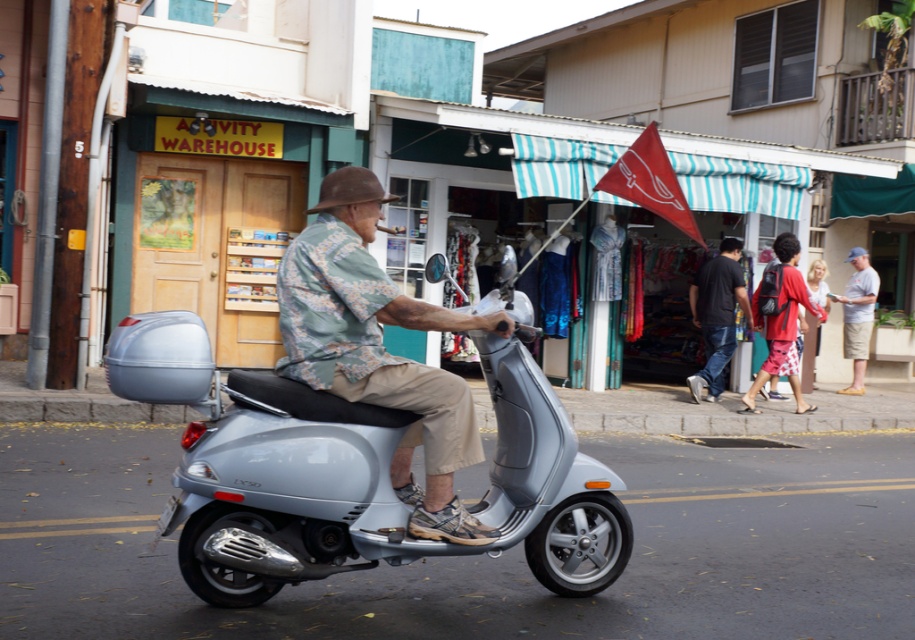
You are a delivery person who needs to park your scooter in the town square. The town square is located at the coordinates point (379,486). Where should you park your scooter to be in the town square?

The town square is located at point (379,486), which is where the metallic silver scooter at center is currently positioned. Therefore, you should park your scooter at the location of the metallic silver scooter at center to be within the town square.

You are a tailor trying to determine if the dark blue jeans at center and the light blue cotton shirt at center can be hung on the same hanger. The hanger has a maximum width capacity of 40 cm. According to the description, can both items be safely hung together?

The dark blue jeans at center might be wider than light blue cotton shirt at center. However, without specific width measurements for each item, it is impossible to confirm if their combined width exceeds the hanger capacity. The description only states a possible width comparison, not exact dimensions.

You are a pedestrian standing on the sidewalk and see the metallic silver scooter at center and the dark blue jeans at center. Which object is closer to the left side of the road?

The metallic silver scooter at center is positioned on the left side of dark blue jeans at center, so it is closer to the left side of the road.